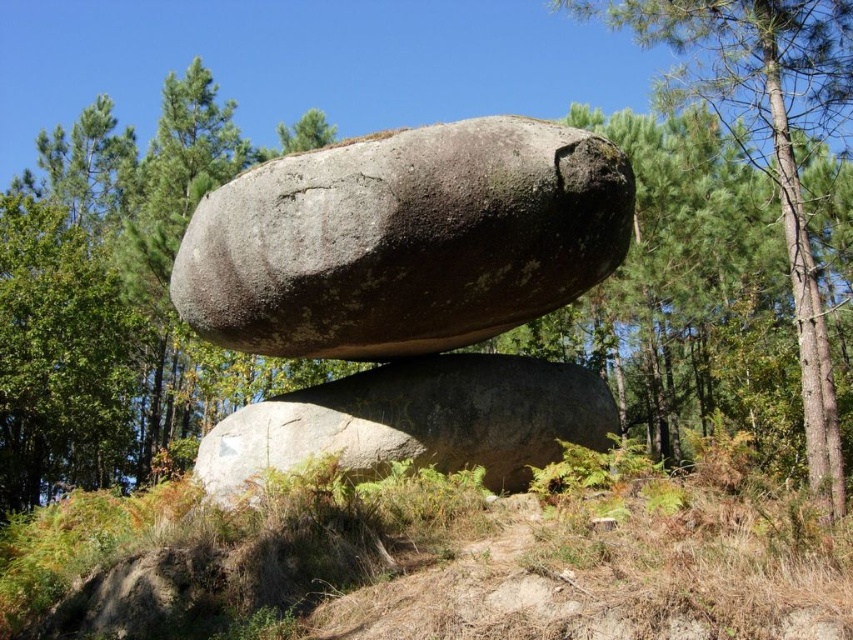
Question: Which of the following is the closest to the observer?

Choices:
 (A) (300, 392)
 (B) (695, 81)
 (C) (375, 186)

Answer: (C)

Question: Among these points, which one is farthest from the camera?

Choices:
 (A) (459, 241)
 (B) (735, 74)
 (C) (312, 428)

Answer: (B)

Question: Does gray rough rock at center appear over gray rough boulder at center?

Choices:
 (A) yes
 (B) no

Answer: (A)

Question: Is gray rough rock at center above green leafy tree at upper right?

Choices:
 (A) yes
 (B) no

Answer: (A)

Question: Which of the following is the closest to the observer?

Choices:
 (A) green leafy tree at upper right
 (B) gray rough rock at center

Answer: (B)

Question: Is gray rough boulder at center further to the viewer compared to green leafy tree at upper right?

Choices:
 (A) yes
 (B) no

Answer: (B)